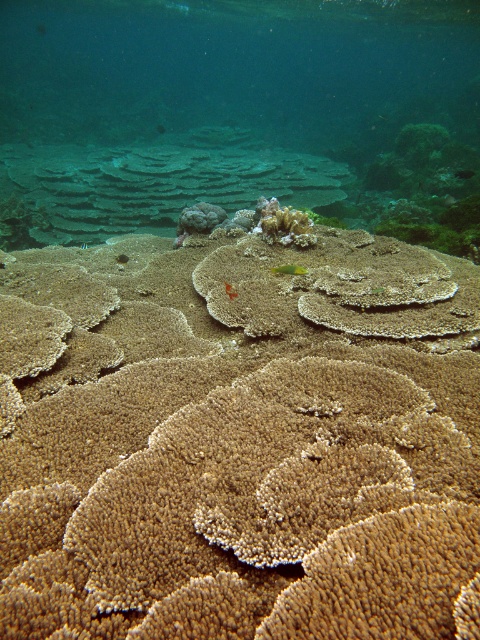
This screenshot has height=640, width=480. Describe the element at coordinates (239, 113) in the screenshot. I see `brown coral at center` at that location.

Who is more distant from viewer, (448, 124) or (228, 282)?

The point (448, 124) is more distant.

I want to click on brown coral at center, so click(239, 113).

Does brown textured coral reef at center have a lesser width compared to translucent orange fish at center?

No, brown textured coral reef at center is not thinner than translucent orange fish at center.

Can you confirm if brown textured coral reef at center is positioned above translucent orange fish at center?

No, brown textured coral reef at center is not above translucent orange fish at center.

Is point (324, 310) positioned after point (231, 289)?

No, (324, 310) is closer to viewer.

The height and width of the screenshot is (640, 480). Identify the location of brown textured coral reef at center. (240, 436).

Which is below, green matte fish at center or translucent orange fish at center?

Positioned lower is translucent orange fish at center.

Measure the distance between green matte fish at center and camera.

green matte fish at center is 12.67 feet from camera.

This screenshot has height=640, width=480. What do you see at coordinates (288, 269) in the screenshot?
I see `green matte fish at center` at bounding box center [288, 269].

What are the coordinates of `green matte fish at center` in the screenshot? It's located at (288, 269).